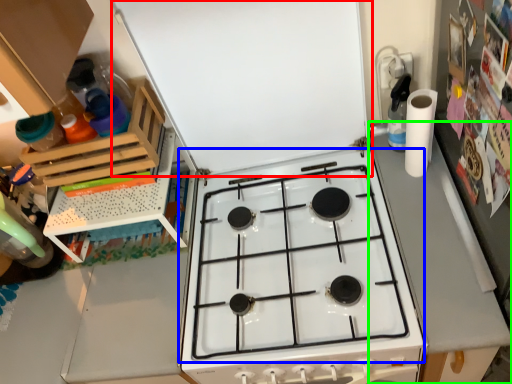
Question: Which is nearer to the exhaust hood (highlighted by a red box)? gas stove (highlighted by a blue box) or counter top (highlighted by a green box).

Choices:
 (A) gas stove
 (B) counter top

Answer: (A)